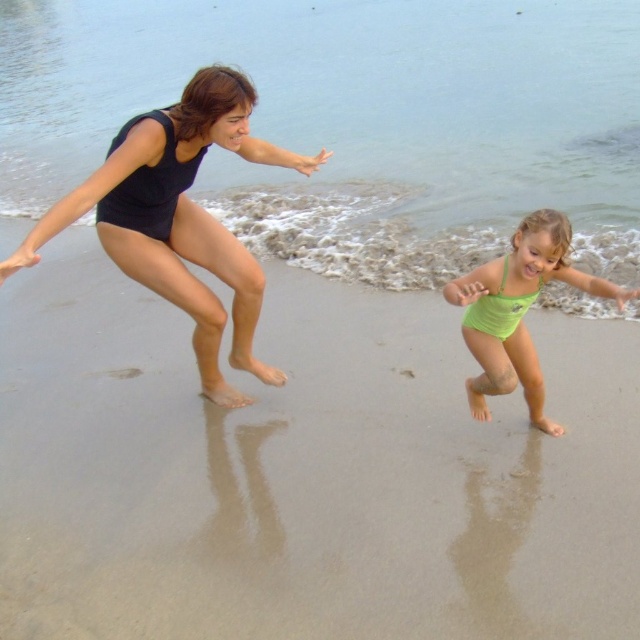
Between matte black swimsuit at left and green matte swimsuit at center, which one is positioned lower?

Positioned lower is green matte swimsuit at center.

Is matte black swimsuit at left smaller than green matte swimsuit at center?

Actually, matte black swimsuit at left might be larger than green matte swimsuit at center.

Locate an element on the screen. The width and height of the screenshot is (640, 640). matte black swimsuit at left is located at coordinates (179, 218).

Is smooth tan sand at center wider than clear blue water at center?

In fact, smooth tan sand at center might be narrower than clear blue water at center.

Can you confirm if smooth tan sand at center is positioned above clear blue water at center?

No, smooth tan sand at center is not above clear blue water at center.

Find the location of `smooth tan sand at center`. smooth tan sand at center is located at coordinates (307, 472).

The width and height of the screenshot is (640, 640). What are the coordinates of `smooth tan sand at center` in the screenshot? It's located at (307, 472).

Is clear blue water at center above matte black swimsuit at left?

Yes.

Identify the location of clear blue water at center. (353, 122).